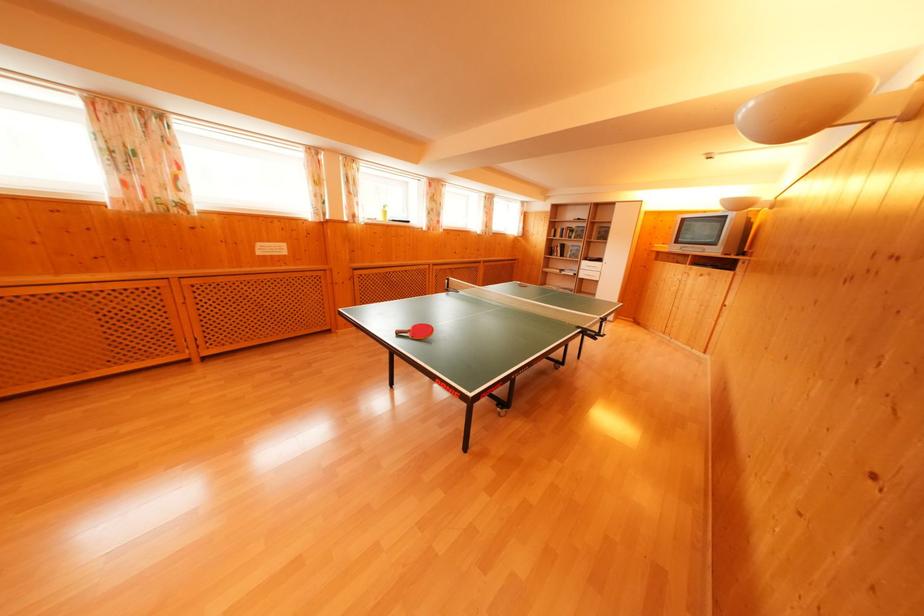
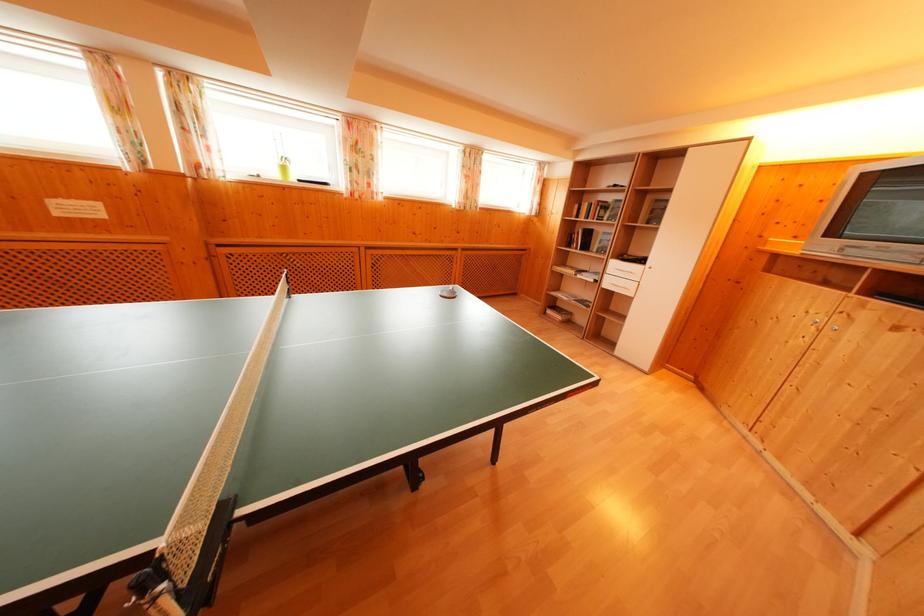
The point at (x=558, y=254) is marked in the first image. Where is the corresponding point in the second image?

(580, 241)